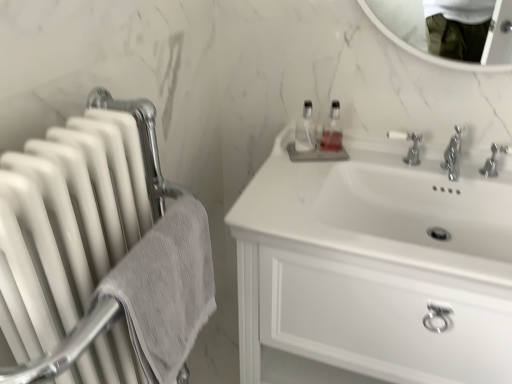
You are a GUI agent. You are given a task and a screenshot of the screen. Output one action in this format:
    pyautogui.click(x=<x>, y=<y>)
    Task: Click on the empty space that is in between translucent plastic soap dispenser at upper center and silver metallic tap at upper center, marked as the second tap in a right-to-left arrangement
    The width and height of the screenshot is (512, 384).
    Given the screenshot: What is the action you would take?
    pyautogui.click(x=362, y=162)